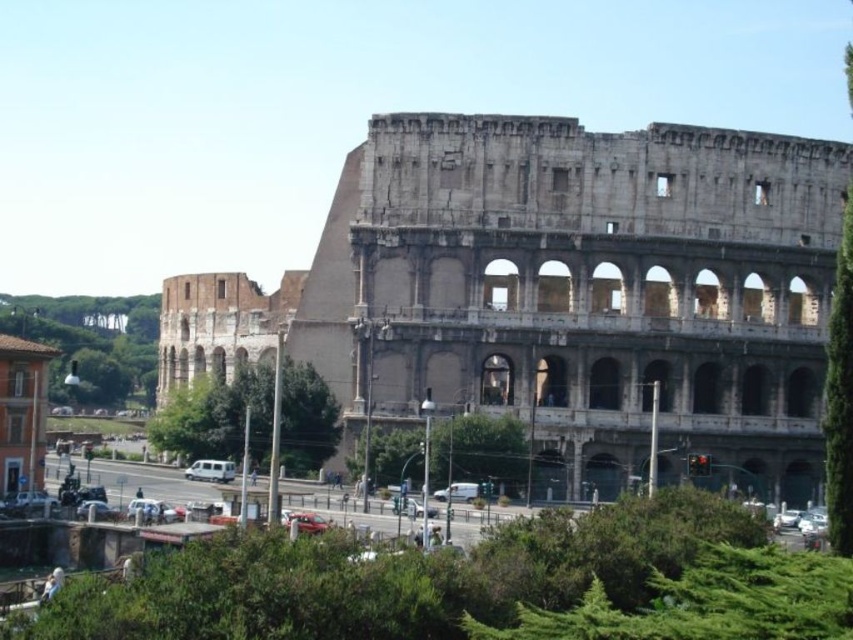
You are a tour guide leading a group to the Colosseum. Your group is standing in front of the gray stone amphitheater at center and the white matte van at center. Which object is taller?

The gray stone amphitheater at center is taller than the white matte van at center.

You are standing in front of the Colosseum and want to take a photo that includes both you and the entire gray stone amphitheater at center. Based on the distance provided, is it possible to capture both in a single frame without moving your position?

The gray stone amphitheater at center is 90.00 meters from viewer. At this distance, it is unlikely that a standard camera lens can capture both the entire amphitheater and a person standing nearby in a single frame without moving your position. A wide angle lens or moving closer might be necessary.